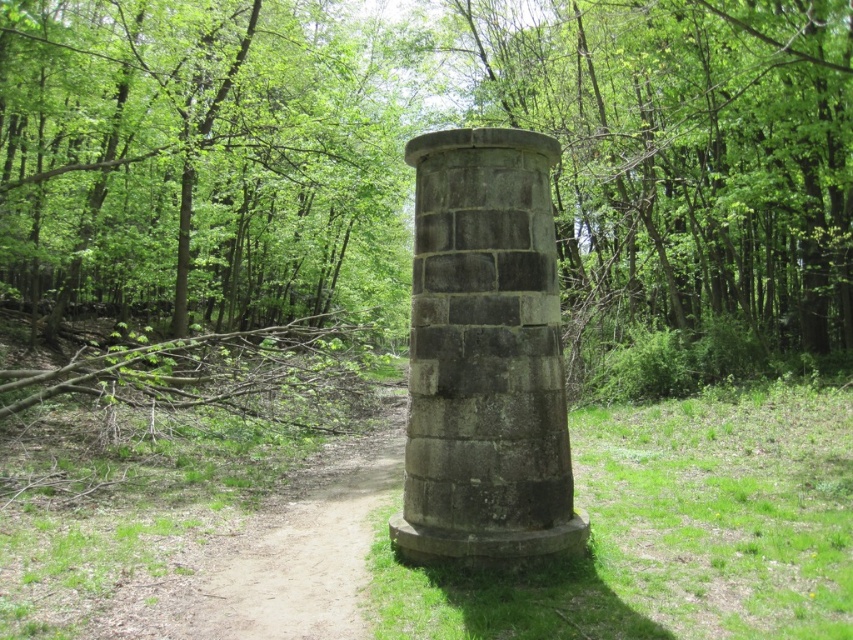
Question: Which of the following is the closest to the observer?

Choices:
 (A) dirt path at lower left
 (B) gray stone column at center

Answer: (A)

Question: Is gray stone column at center bigger than dirt path at lower left?

Choices:
 (A) yes
 (B) no

Answer: (A)

Question: Does gray stone column at center have a greater width compared to dirt path at lower left?

Choices:
 (A) no
 (B) yes

Answer: (B)

Question: Can you confirm if gray stone column at center is positioned above dirt path at lower left?

Choices:
 (A) no
 (B) yes

Answer: (B)